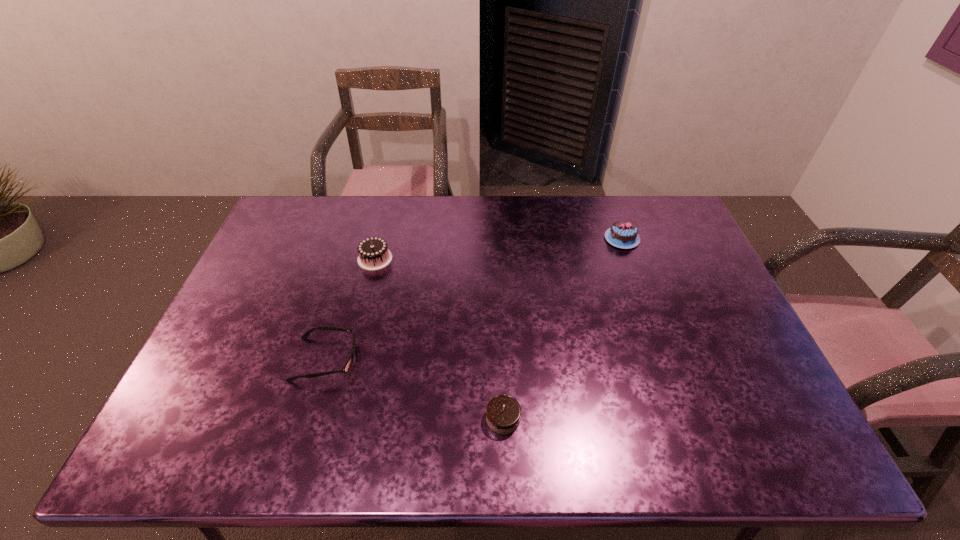
Identify the location of vacant space in between the spectacles and the rightmost chocolate cake. (473, 299).

Where is `vacant region between the rightmost object and the tallest object`? vacant region between the rightmost object and the tallest object is located at coordinates pyautogui.click(x=498, y=248).

Locate an element on the screen. vacant space that is in between the second chocolate cake from right to left and the tallest object is located at coordinates (439, 339).

Locate an element on the screen. vacant space that's between the tallest object and the second object from right to left is located at coordinates (439, 339).

In order to click on unoccupied position between the third farthest object and the nearest object in this screenshot , I will do `click(414, 389)`.

Identify the location of empty space that is in between the tallest chocolate cake and the rightmost object. (498, 248).

Where is `unoccupied position between the shortest object and the rightmost chocolate cake`? unoccupied position between the shortest object and the rightmost chocolate cake is located at coordinates (473, 299).

You are a GUI agent. You are given a task and a screenshot of the screen. Output one action in this format:
    pyautogui.click(x=<x>, y=<y>)
    Task: Click on the vacant space that is in between the shortest object and the leftmost chocolate cake
    Image resolution: width=960 pixels, height=540 pixels.
    Given the screenshot: What is the action you would take?
    pyautogui.click(x=350, y=309)

The width and height of the screenshot is (960, 540). Find the location of `free space between the nearest chocolate cake and the tallest chocolate cake`. free space between the nearest chocolate cake and the tallest chocolate cake is located at coordinates (439, 339).

Identify which object is the third nearest to the rightmost object. Please provide its 2D coordinates. Your answer should be formatted as a tuple, i.e. [(x, y)], where the tuple contains the x and y coordinates of a point satisfying the conditions above.

[(348, 364)]